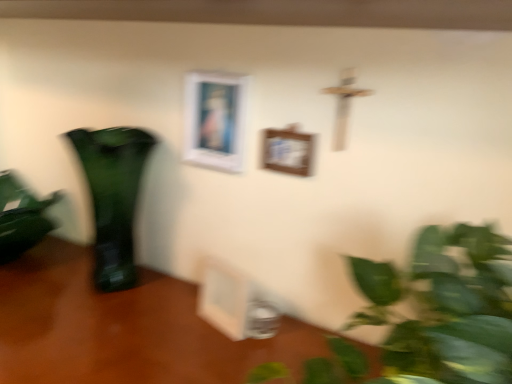
Question: Is wooden picture frame at center, marked as the second picture frame in a top-to-bottom arrangement, taller or shorter than green glossy houseplant at left?

Choices:
 (A) short
 (B) tall

Answer: (A)

Question: From a real-world perspective, relative to green glossy houseplant at left, is wooden picture frame at center, marked as the second picture frame in a top-to-bottom arrangement, vertically above or below?

Choices:
 (A) above
 (B) below

Answer: (A)

Question: Which object is the farthest from the wooden table at lower left?

Choices:
 (A) wooden picture frame at center, the third picture frame when ordered from top to bottom
 (B) green glass vase at left
 (C) green glossy houseplant at left
 (D) white matte picture frame at upper center, which is the 1th picture frame from top to bottom
 (E) wooden picture frame at center, marked as the second picture frame in a top-to-bottom arrangement

Answer: (E)

Question: Which of these objects is positioned closest to the white matte picture frame at upper center, which is the 1th picture frame from top to bottom?

Choices:
 (A) wooden picture frame at center, which ranks as the 2th picture frame in bottom-to-top order
 (B) wooden picture frame at center, acting as the first picture frame starting from the bottom
 (C) green glossy houseplant at left
 (D) wooden table at lower left
 (E) green glass vase at left

Answer: (A)